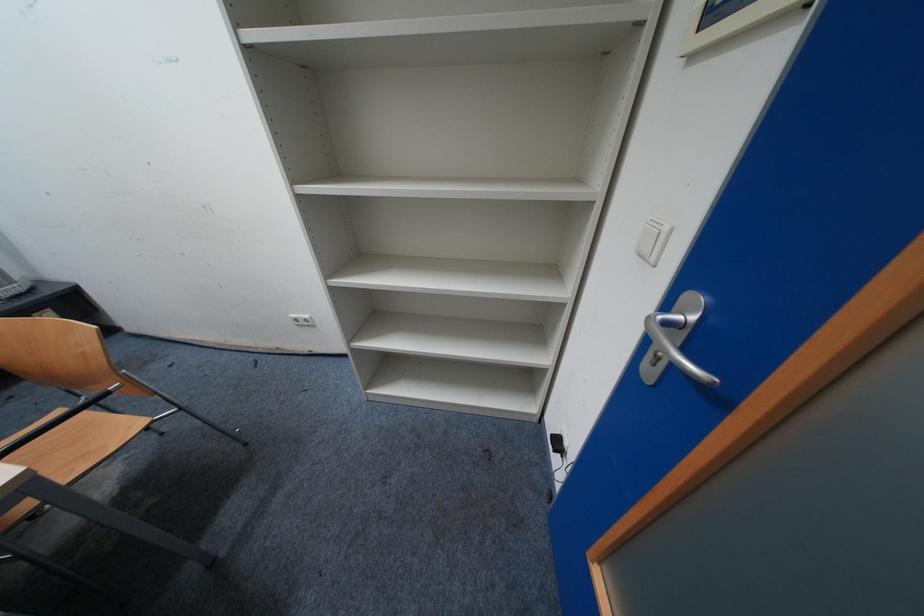
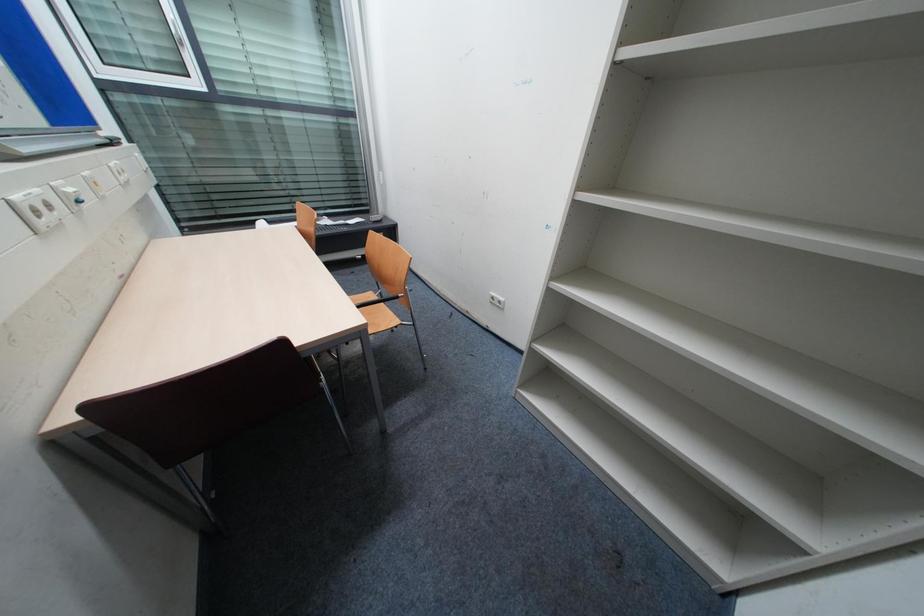
Question: The camera is either moving clockwise (left) or counter-clockwise (right) around the object. The first image is from the beginning of the video and the second image is from the end. Is the camera moving left or right when shooting the video?

Choices:
 (A) Left
 (B) Right

Answer: (B)